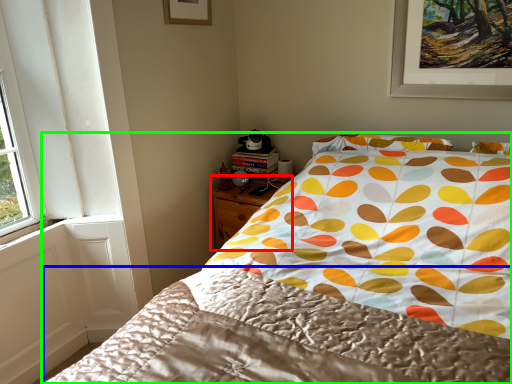
Question: Considering the real-world distances, which object is closest to nightstand (highlighted by a red box)? blanket (highlighted by a blue box) or bed (highlighted by a green box).

Choices:
 (A) blanket
 (B) bed

Answer: (B)